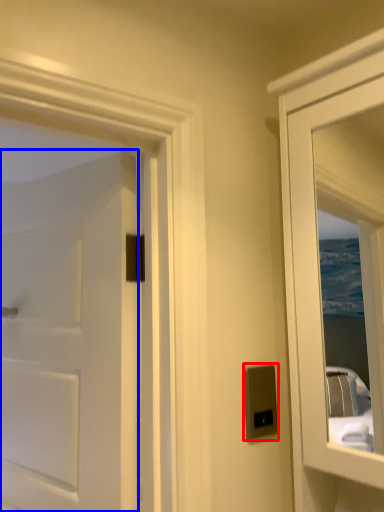
Question: Which object is further to the camera taking this photo, electric outlet (highlighted by a red box) or door (highlighted by a blue box)?

Choices:
 (A) electric outlet
 (B) door

Answer: (A)